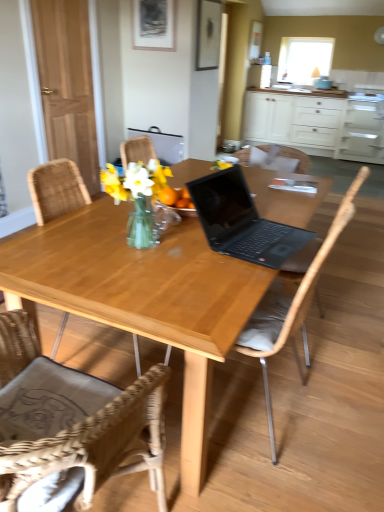
I want to click on free space in front of translucent glass vase at center, so click(134, 271).